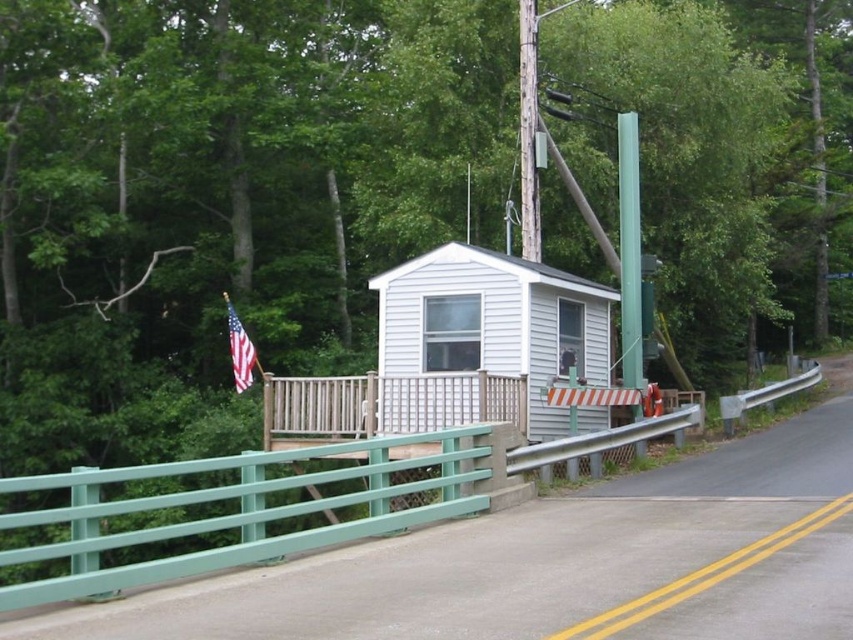
Does green painted metal fence at lower left appear on the right side of american flag at left?

Yes, green painted metal fence at lower left is to the right of american flag at left.

Does point (262, 536) come farther from viewer compared to point (228, 298)?

No, (262, 536) is in front of (228, 298).

Who is more distant from viewer, (483, 428) or (233, 323)?

The point (233, 323) is behind.

Locate an element on the screen. Image resolution: width=853 pixels, height=640 pixels. green painted metal fence at lower left is located at coordinates (236, 513).

Is weathered wood pole at upper center taller than american flag at left?

Indeed, weathered wood pole at upper center has a greater height compared to american flag at left.

Between weathered wood pole at upper center and american flag at left, which one has more height?

Standing taller between the two is weathered wood pole at upper center.

Image resolution: width=853 pixels, height=640 pixels. Describe the element at coordinates (527, 131) in the screenshot. I see `weathered wood pole at upper center` at that location.

The height and width of the screenshot is (640, 853). What are the coordinates of `weathered wood pole at upper center` in the screenshot? It's located at (527, 131).

Who is positioned more to the left, green painted metal fence at lower left or weathered wood pole at upper center?

green painted metal fence at lower left is more to the left.

Is green painted metal fence at lower left smaller than weathered wood pole at upper center?

No.

What do you see at coordinates (236, 513) in the screenshot?
I see `green painted metal fence at lower left` at bounding box center [236, 513].

Image resolution: width=853 pixels, height=640 pixels. Identify the location of green painted metal fence at lower left. (236, 513).